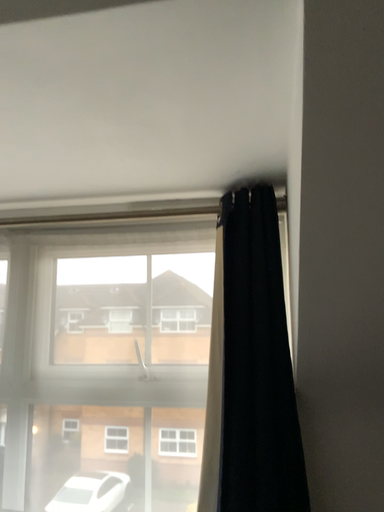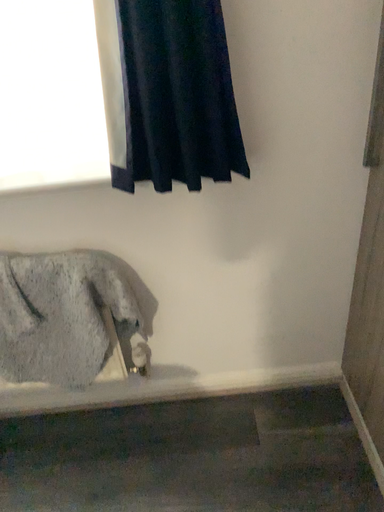
Question: Which way did the camera rotate in the video?

Choices:
 (A) rotated downward
 (B) rotated upward

Answer: (A)